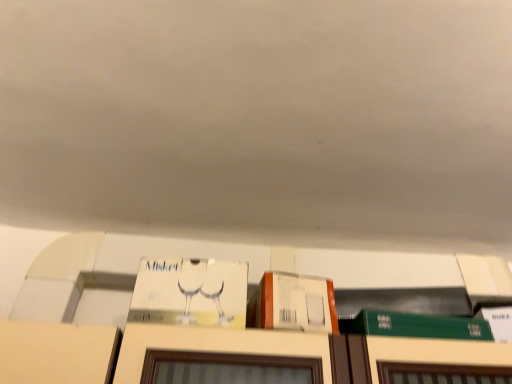
Find the location of a particular element. The image size is (512, 384). white cardboard box at center, the second book viewed from the right is located at coordinates (190, 293).

In order to face orange matte cardboard box at upper center, should I rotate leftwards or rightwards?

Turn right by 5.331 degrees to look at orange matte cardboard box at upper center.

Image resolution: width=512 pixels, height=384 pixels. In order to click on white cardboard box at center, arranged as the 1th book when viewed from the left in this screenshot , I will do `click(190, 293)`.

From the image's perspective, relative to green matte book at lower right, the second book from the left, is white cardboard box at center, the second book viewed from the right, above or below?

white cardboard box at center, the second book viewed from the right, is above green matte book at lower right, the second book from the left.

Does white cardboard box at center, arranged as the 1th book when viewed from the left, turn towards green matte book at lower right, the second book from the left?

No, white cardboard box at center, arranged as the 1th book when viewed from the left, is not aimed at green matte book at lower right, the second book from the left.

Is white cardboard box at center, the second book viewed from the right, not close to green matte book at lower right, which is counted as the first book, starting from the right?

No, there isn't a large distance between white cardboard box at center, the second book viewed from the right, and green matte book at lower right, which is counted as the first book, starting from the right.

Find the location of `cardboard box that is above the green matte book at lower right, the second book from the left (from a real-world perspective)`. cardboard box that is above the green matte book at lower right, the second book from the left (from a real-world perspective) is located at coordinates (297, 303).

Is orange matte cardboard box at upper center not inside green matte book at lower right, which is counted as the first book, starting from the right?

That's correct, orange matte cardboard box at upper center is outside of green matte book at lower right, which is counted as the first book, starting from the right.

Is there a large distance between orange matte cardboard box at upper center and green matte book at lower right, which is counted as the first book, starting from the right?

No, orange matte cardboard box at upper center is not far away from green matte book at lower right, which is counted as the first book, starting from the right.

Would you say orange matte cardboard box at upper center is part of green matte book at lower right, which is counted as the first book, starting from the right,'s contents?

No, orange matte cardboard box at upper center is not inside green matte book at lower right, which is counted as the first book, starting from the right.

Are green matte book at lower right, the second book from the left, and orange matte cardboard box at upper center beside each other?

green matte book at lower right, the second book from the left, and orange matte cardboard box at upper center are clearly separated.

Is green matte book at lower right, which is counted as the first book, starting from the right, thinner than orange matte cardboard box at upper center?

Incorrect, the width of green matte book at lower right, which is counted as the first book, starting from the right, is not less than that of orange matte cardboard box at upper center.

From the picture: From the image's perspective, is green matte book at lower right, which is counted as the first book, starting from the right, under orange matte cardboard box at upper center?

Yes.

Who is shorter, orange matte cardboard box at upper center or white cardboard box at center, the second book viewed from the right?

With less height is orange matte cardboard box at upper center.

Is orange matte cardboard box at upper center outside of white cardboard box at center, the second book viewed from the right?

orange matte cardboard box at upper center lies outside white cardboard box at center, the second book viewed from the right,'s area.

Based on the photo, considering the sizes of objects orange matte cardboard box at upper center and white cardboard box at center, the second book viewed from the right, in the image provided, who is wider, orange matte cardboard box at upper center or white cardboard box at center, the second book viewed from the right,?

orange matte cardboard box at upper center is wider.

Is green matte book at lower right, which is counted as the first book, starting from the right, located outside white cardboard box at center, arranged as the 1th book when viewed from the left?

green matte book at lower right, which is counted as the first book, starting from the right, is positioned outside white cardboard box at center, arranged as the 1th book when viewed from the left.

I want to click on book in front of the green matte book at lower right, which is counted as the first book, starting from the right, so click(190, 293).

From the image's perspective, is green matte book at lower right, the second book from the left, located beneath white cardboard box at center, the second book viewed from the right?

Indeed, from the image's perspective, green matte book at lower right, the second book from the left, is shown beneath white cardboard box at center, the second book viewed from the right.

How many degrees apart are the facing directions of green matte book at lower right, the second book from the left, and white cardboard box at center, the second book viewed from the right?

5.39 degrees separate the facing orientations of green matte book at lower right, the second book from the left, and white cardboard box at center, the second book viewed from the right.

Considering the positions of point (224, 297) and point (261, 281), is point (224, 297) closer or farther from the camera than point (261, 281)?

Clearly, point (224, 297) is closer to the camera than point (261, 281).

Is white cardboard box at center, the second book viewed from the right, positioned far away from orange matte cardboard box at upper center?

white cardboard box at center, the second book viewed from the right, is actually quite close to orange matte cardboard box at upper center.

Considering their positions, is white cardboard box at center, the second book viewed from the right, located in front of or behind orange matte cardboard box at upper center?

Visually, white cardboard box at center, the second book viewed from the right, is located behind orange matte cardboard box at upper center.

At what (x,y) coordinates should I click in order to perform the action: click on book below the white cardboard box at center, arranged as the 1th book when viewed from the left (from the image's perspective). Please return your answer as a coordinate pair (x, y). Looking at the image, I should click on (416, 325).

Locate an element on the screen. Image resolution: width=512 pixels, height=384 pixels. cardboard box above the green matte book at lower right, which is counted as the first book, starting from the right (from the image's perspective) is located at coordinates (297, 303).

When comparing their distances from white cardboard box at center, arranged as the 1th book when viewed from the left, does orange matte cardboard box at upper center or green matte book at lower right, the second book from the left, seem closer?

orange matte cardboard box at upper center is closer to white cardboard box at center, arranged as the 1th book when viewed from the left.

Which object lies further to the anchor point green matte book at lower right, the second book from the left, orange matte cardboard box at upper center or white cardboard box at center, the second book viewed from the right?

white cardboard box at center, the second book viewed from the right, is further to green matte book at lower right, the second book from the left.

Looking at the image, which one is located further to white cardboard box at center, the second book viewed from the right, green matte book at lower right, which is counted as the first book, starting from the right, or orange matte cardboard box at upper center?

green matte book at lower right, which is counted as the first book, starting from the right, lies further to white cardboard box at center, the second book viewed from the right, than the other object.

Looking at the image, which one is located further to green matte book at lower right, which is counted as the first book, starting from the right, white cardboard box at center, arranged as the 1th book when viewed from the left, or orange matte cardboard box at upper center?

Based on the image, white cardboard box at center, arranged as the 1th book when viewed from the left, appears to be further to green matte book at lower right, which is counted as the first book, starting from the right.

Looking at the image, which one is located closer to orange matte cardboard box at upper center, white cardboard box at center, arranged as the 1th book when viewed from the left, or green matte book at lower right, the second book from the left?

Among the two, white cardboard box at center, arranged as the 1th book when viewed from the left, is located nearer to orange matte cardboard box at upper center.

When comparing their distances from orange matte cardboard box at upper center, does green matte book at lower right, the second book from the left, or white cardboard box at center, arranged as the 1th book when viewed from the left, seem further?

Among the two, green matte book at lower right, the second book from the left, is located further to orange matte cardboard box at upper center.

This screenshot has height=384, width=512. I want to click on cardboard box between white cardboard box at center, arranged as the 1th book when viewed from the left, and green matte book at lower right, which is counted as the first book, starting from the right, in the horizontal direction, so click(297, 303).